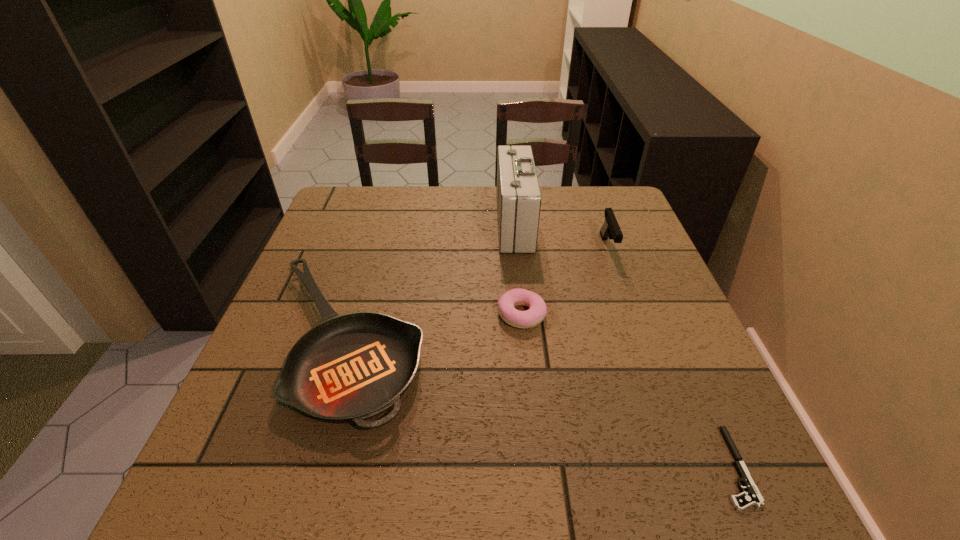
At what (x,y) coordinates should I click in order to perform the action: click on vacant space at the far edge of the desktop. Please return your answer as a coordinate pair (x, y). The height and width of the screenshot is (540, 960). Looking at the image, I should click on (489, 222).

In order to click on free space at the near edge of the desktop in this screenshot , I will do `click(301, 511)`.

This screenshot has height=540, width=960. What are the coordinates of `vacant space at the left edge` in the screenshot? It's located at (331, 269).

Where is `free space at the right edge`? Image resolution: width=960 pixels, height=540 pixels. free space at the right edge is located at coordinates (662, 289).

In the image, there is a desktop. What are the coordinates of `free space at the far left corner` in the screenshot? It's located at (322, 225).

What are the coordinates of `vacant region at the far right corner` in the screenshot? It's located at (584, 193).

Image resolution: width=960 pixels, height=540 pixels. In the image, there is a desktop. What are the coordinates of `vacant space at the near right corner` in the screenshot? It's located at (677, 474).

Locate an element on the screen. vacant point located between the tallest object and the farther pistol is located at coordinates (561, 236).

Locate an element on the screen. This screenshot has width=960, height=540. free space between the frying pan and the pastry is located at coordinates (433, 327).

Find the location of a particular element. Image resolution: width=960 pixels, height=540 pixels. free point between the pastry and the frying pan is located at coordinates (433, 327).